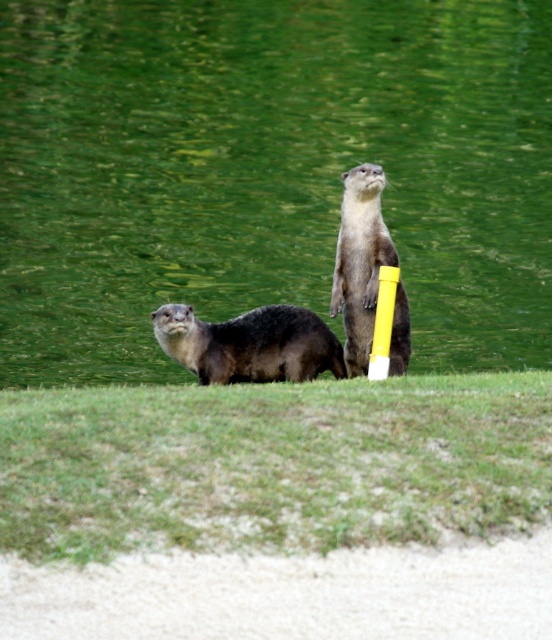
Image resolution: width=552 pixels, height=640 pixels. What are the coordinates of `green water at center` in the screenshot? It's located at (268, 172).

Is point (311, 145) closer to viewer compared to point (371, 176)?

No, it is behind (371, 176).

Image resolution: width=552 pixels, height=640 pixels. I want to click on green water at center, so click(x=268, y=172).

Who is taller, green water at center or shiny brown otter at center?

green water at center

Can you confirm if green water at center is thinner than shiny brown otter at center?

In fact, green water at center might be wider than shiny brown otter at center.

The width and height of the screenshot is (552, 640). What are the coordinates of `green water at center` in the screenshot? It's located at (268, 172).

I want to click on green water at center, so click(x=268, y=172).

Can you confirm if shiny brown otter at center is bigger than soft brown fur otter at center?

Indeed, shiny brown otter at center has a larger size compared to soft brown fur otter at center.

Is point (230, 332) in front of point (359, 310)?

Yes, point (230, 332) is closer to viewer.

What do you see at coordinates (250, 344) in the screenshot?
I see `shiny brown otter at center` at bounding box center [250, 344].

Where is `shiny brown otter at center`? The image size is (552, 640). shiny brown otter at center is located at coordinates (250, 344).